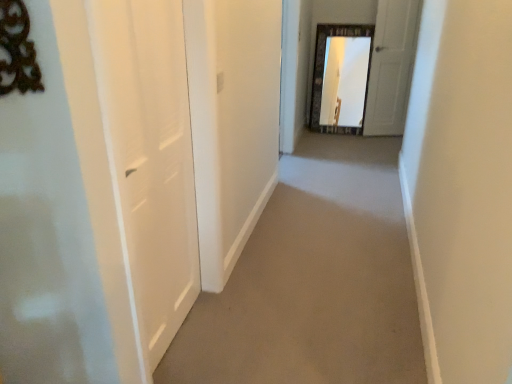
Question: Is beige carpet at center next to white matte door at upper right, marked as the first door in a top-to-bottom arrangement, and touching it?

Choices:
 (A) yes
 (B) no

Answer: (B)

Question: Can you confirm if beige carpet at center is smaller than white matte door at upper right, positioned as the 1th door in back-to-front order?

Choices:
 (A) yes
 (B) no

Answer: (B)

Question: Is beige carpet at center not near white matte door at upper right, positioned as the second door in left-to-right order?

Choices:
 (A) no
 (B) yes

Answer: (B)

Question: Is beige carpet at center at the left side of white matte door at upper right, arranged as the 2th door when viewed from the front?

Choices:
 (A) no
 (B) yes

Answer: (B)

Question: Does beige carpet at center have a greater height compared to white matte door at upper right, positioned as the second door in left-to-right order?

Choices:
 (A) no
 (B) yes

Answer: (A)

Question: Considering the positions of point (179, 345) and point (391, 97), is point (179, 345) closer or farther from the camera than point (391, 97)?

Choices:
 (A) closer
 (B) farther

Answer: (A)

Question: From a real-world perspective, is beige carpet at center physically located above or below white matte door at upper right, placed as the second door when sorted from bottom to top?

Choices:
 (A) below
 (B) above

Answer: (A)

Question: Is beige carpet at center situated inside white matte door at upper right, placed as the second door when sorted from bottom to top, or outside?

Choices:
 (A) inside
 (B) outside

Answer: (B)

Question: From their relative heights in the image, would you say beige carpet at center is taller or shorter than white matte door at upper right, positioned as the second door in left-to-right order?

Choices:
 (A) tall
 (B) short

Answer: (B)

Question: Considering their positions, is white matte door at upper right, marked as the first door in a top-to-bottom arrangement, located in front of or behind beige carpet at center?

Choices:
 (A) front
 (B) behind

Answer: (B)

Question: Does point (396, 66) appear closer or farther from the camera than point (296, 329)?

Choices:
 (A) closer
 (B) farther

Answer: (B)

Question: Is white matte door at upper right, marked as the first door in a top-to-bottom arrangement, situated inside beige carpet at center or outside?

Choices:
 (A) outside
 (B) inside

Answer: (A)

Question: Considering the positions of white matte door at upper right, placed as the second door when sorted from bottom to top, and beige carpet at center in the image, is white matte door at upper right, placed as the second door when sorted from bottom to top, bigger or smaller than beige carpet at center?

Choices:
 (A) small
 (B) big

Answer: (A)

Question: Relative to white matte door at left, which is counted as the second door, starting from the back, is beige carpet at center in front or behind?

Choices:
 (A) front
 (B) behind

Answer: (B)

Question: From a real-world perspective, relative to white matte door at left, which appears as the 1th door when viewed from the left, is beige carpet at center vertically above or below?

Choices:
 (A) below
 (B) above

Answer: (A)